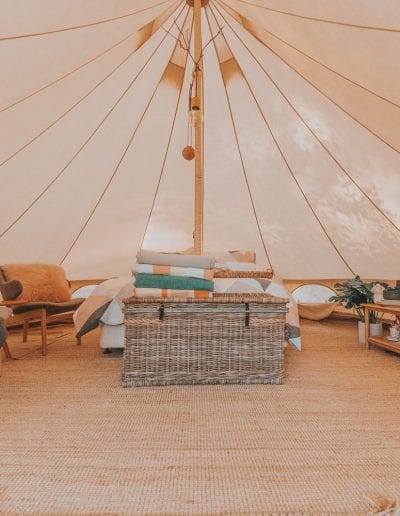
Where is `furniture legs`? The image size is (400, 516). furniture legs is located at coordinates (45, 343), (24, 336), (7, 353), (78, 340), (366, 344).